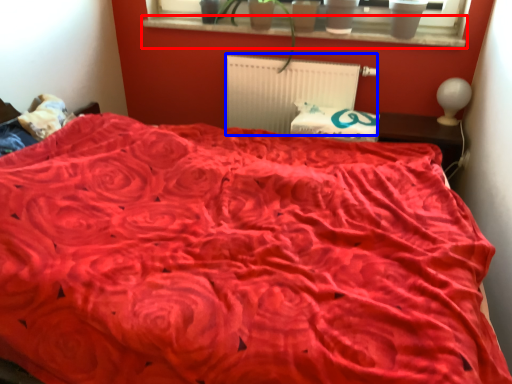
Question: Which object appears farthest to the camera in this image, window sill (highlighted by a red box) or radiator (highlighted by a blue box)?

Choices:
 (A) window sill
 (B) radiator

Answer: (B)